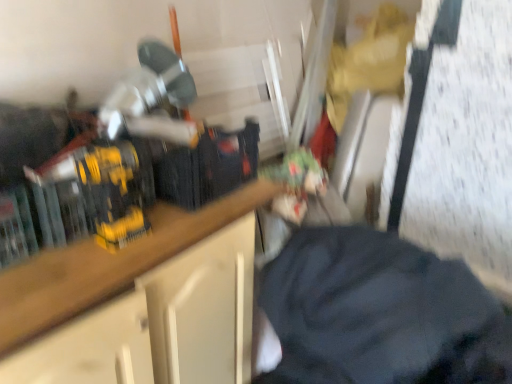
Question: Relative to wooden countertop at center, is black fabric at center in front or behind?

Choices:
 (A) behind
 (B) front

Answer: (B)

Question: In terms of width, does black fabric at center look wider or thinner when compared to wooden countertop at center?

Choices:
 (A) thin
 (B) wide

Answer: (B)

Question: Is point (435, 354) closer or farther from the camera than point (224, 225)?

Choices:
 (A) closer
 (B) farther

Answer: (A)

Question: Looking at the image, does wooden countertop at center seem bigger or smaller compared to black fabric at center?

Choices:
 (A) big
 (B) small

Answer: (A)

Question: In the image, is wooden countertop at center on the left side or the right side of black fabric at center?

Choices:
 (A) right
 (B) left

Answer: (B)

Question: Relative to black fabric at center, is wooden countertop at center in front or behind?

Choices:
 (A) behind
 (B) front

Answer: (A)

Question: Would you say wooden countertop at center is inside or outside black fabric at center?

Choices:
 (A) inside
 (B) outside

Answer: (B)